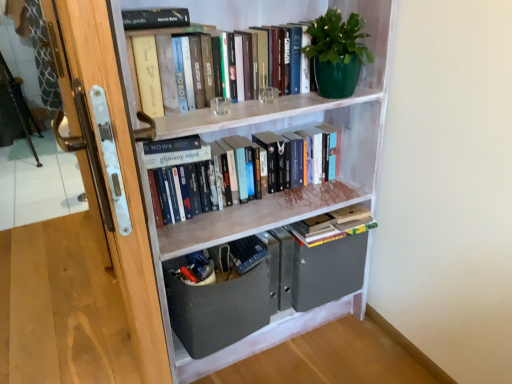
Question: Considering the relative sizes of green matte pot at upper right and hardcover books at center, placed as the 2th book when sorted from top to bottom, in the image provided, is green matte pot at upper right taller than hardcover books at center, placed as the 2th book when sorted from top to bottom,?

Choices:
 (A) yes
 (B) no

Answer: (A)

Question: From the image's perspective, is green matte pot at upper right below hardcover books at center, placed as the 2th book when sorted from top to bottom?

Choices:
 (A) yes
 (B) no

Answer: (B)

Question: Is green matte pot at upper right outside hardcover books at center, positioned as the 2th book in bottom-to-top order?

Choices:
 (A) no
 (B) yes

Answer: (B)

Question: Can you confirm if green matte pot at upper right is smaller than hardcover books at center, positioned as the 2th book in bottom-to-top order?

Choices:
 (A) no
 (B) yes

Answer: (B)

Question: Is green matte pot at upper right next to hardcover books at center, positioned as the 2th book in bottom-to-top order?

Choices:
 (A) no
 (B) yes

Answer: (A)

Question: Could you tell me if green matte pot at upper right is facing hardcover books at center, positioned as the 2th book in bottom-to-top order?

Choices:
 (A) yes
 (B) no

Answer: (B)

Question: Is hardcover books at center, positioned as the 2th book in bottom-to-top order, looking in the opposite direction of hardcover books at upper center, which is the first book from top to bottom?

Choices:
 (A) yes
 (B) no

Answer: (B)

Question: Is hardcover books at center, placed as the 2th book when sorted from top to bottom, smaller than hardcover books at upper center, which is the first book from top to bottom?

Choices:
 (A) no
 (B) yes

Answer: (A)

Question: Is hardcover books at upper center, arranged as the 3th book when ordered from the bottom, surrounded by hardcover books at center, positioned as the 2th book in bottom-to-top order?

Choices:
 (A) yes
 (B) no

Answer: (B)

Question: Is the depth of hardcover books at center, positioned as the 2th book in bottom-to-top order, less than that of hardcover books at upper center, arranged as the 3th book when ordered from the bottom?

Choices:
 (A) no
 (B) yes

Answer: (A)

Question: From a real-world perspective, is hardcover books at center, positioned as the 2th book in bottom-to-top order, positioned under hardcover books at upper center, which is the first book from top to bottom, based on gravity?

Choices:
 (A) yes
 (B) no

Answer: (A)

Question: Is hardcover books at center, placed as the 2th book when sorted from top to bottom, far from hardcover books at upper center, arranged as the 3th book when ordered from the bottom?

Choices:
 (A) no
 (B) yes

Answer: (A)

Question: Is hardcover books at center, positioned as the 2th book in bottom-to-top order, positioned behind green matte pot at upper right?

Choices:
 (A) no
 (B) yes

Answer: (B)